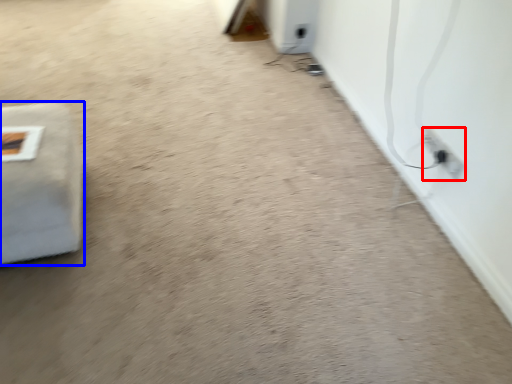
Question: Which of the following is the farthest to the observer, electric outlet (highlighted by a red box) or furniture (highlighted by a blue box)?

Choices:
 (A) electric outlet
 (B) furniture

Answer: (A)